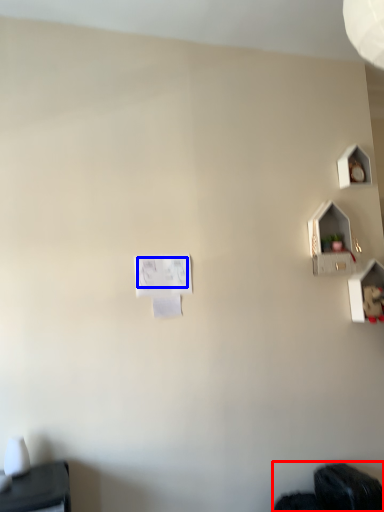
Question: Which of the following is the closest to the observer, wide (highlighted by a red box) or writing (highlighted by a blue box)?

Choices:
 (A) wide
 (B) writing

Answer: (A)